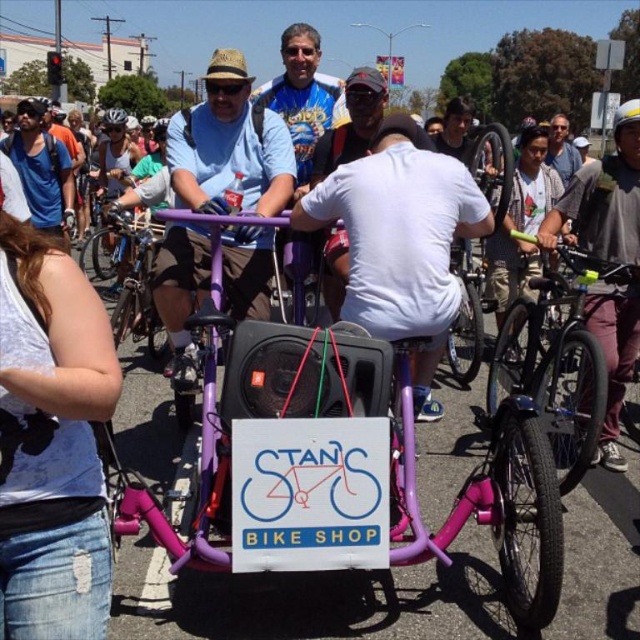
You are a photographer standing at the center of the scene. You want to take a photo of the maroon fabric helmet at upper right. According to the coordinates provided, where should you aim your camera to capture it?

The maroon fabric helmet at upper right is located at coordinates point (608,260). To capture it, aim your camera towards the upper right area of the scene at those coordinates.

You are a safety inspector checking helmets at a bike event. You need to ensure that all helmets meet the minimum thickness requirement of 3 cm. The maroon fabric helmet at upper right and the white matte bicycle helmet at upper center are both on display. Which helmet is more likely to meet the requirement based on their thickness?

The white matte bicycle helmet at upper center is thicker than the maroon fabric helmet at upper right, so it is more likely to meet the minimum thickness requirement of 3 cm.

You are a photographer at the community bike ride event. You want to take a photo that includes both the matte gray shirt at center and the white matte bicycle helmet at upper right. Based on their positions, which object should you adjust your camera angle to focus on first to ensure both are in frame?

The matte gray shirt at center is positioned on the right side of the white matte bicycle helmet at upper right. To capture both in the frame, you should first focus on the white matte bicycle helmet at upper right since it is on the left side, allowing the matte gray shirt at center to naturally fall into the frame to the right.